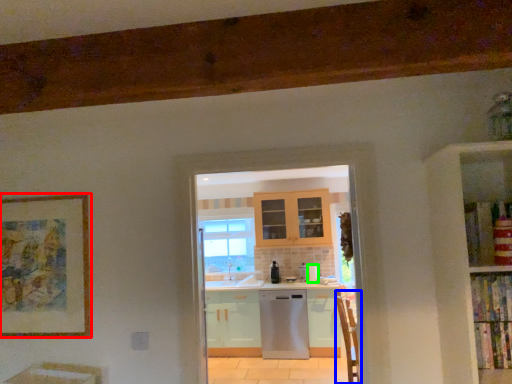
Question: Which is farther away from picture frame (highlighted by a red box)? armchair (highlighted by a blue box) or appliance (highlighted by a green box)?

Choices:
 (A) armchair
 (B) appliance

Answer: (B)